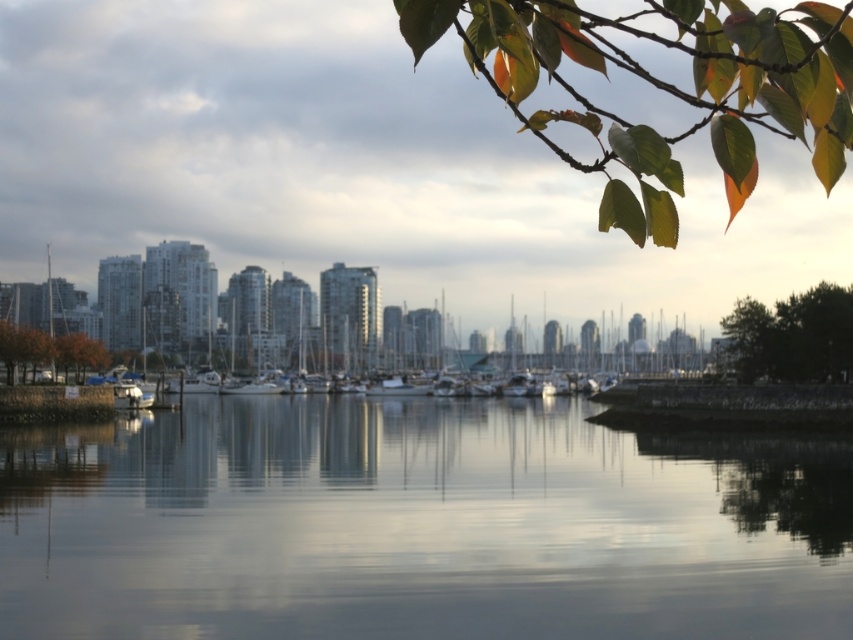
Question: Estimate the real-world distances between objects in this image. Which object is closer to the green leafy branch at upper right?

Choices:
 (A) clear water at center
 (B) orange matte tree at left

Answer: (A)

Question: Is the position of green leafy tree at upper right more distant than that of orange matte tree at left?

Choices:
 (A) yes
 (B) no

Answer: (B)

Question: Which object is farther from the camera taking this photo?

Choices:
 (A) orange matte tree at left
 (B) white glossy boats at center
 (C) clear water at center

Answer: (B)

Question: Which of the following is the closest to the observer?

Choices:
 (A) (0, 337)
 (B) (788, 632)
 (C) (735, 195)

Answer: (C)

Question: Is green leafy branch at upper right to the right of white glossy boats at center from the viewer's perspective?

Choices:
 (A) yes
 (B) no

Answer: (B)

Question: Can you confirm if green leafy branch at upper right is thinner than white glossy boats at center?

Choices:
 (A) no
 (B) yes

Answer: (B)